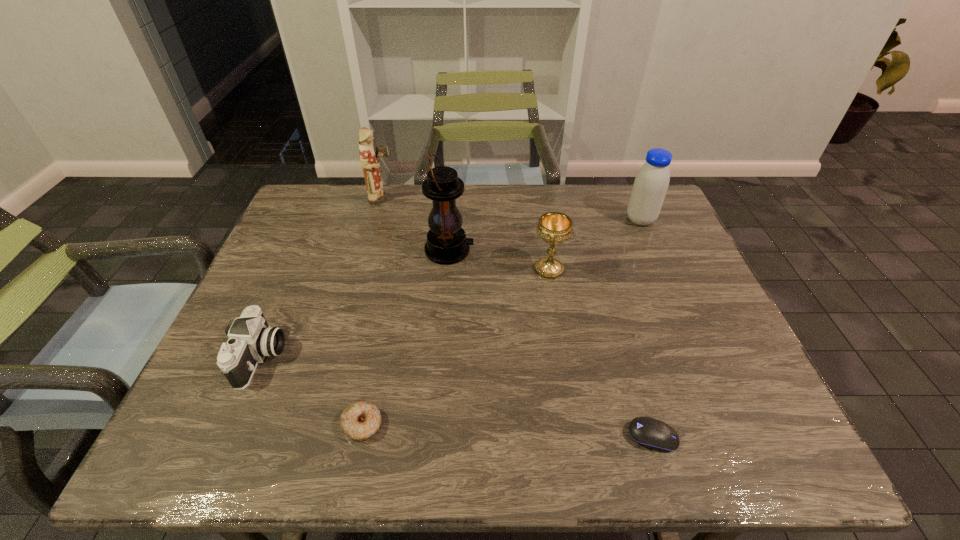
Identify the location of the tallest object. The height and width of the screenshot is (540, 960). (446, 243).

Find the location of a particular element. Image resolution: width=960 pixels, height=540 pixels. lantern is located at coordinates (446, 243).

Find the location of `the sixth object from right to left`. the sixth object from right to left is located at coordinates (368, 158).

This screenshot has width=960, height=540. In order to click on the farthest object in this screenshot , I will do `click(368, 158)`.

Where is `soya milk`? The width and height of the screenshot is (960, 540). soya milk is located at coordinates (651, 183).

Locate an element on the screen. the rightmost object is located at coordinates (651, 183).

Where is `the third object from right to left`? the third object from right to left is located at coordinates (554, 228).

The image size is (960, 540). Identify the location of the fourth shortest object. (554, 228).

The image size is (960, 540). Identify the location of the leftmost object. (250, 338).

Locate an element on the screen. The width and height of the screenshot is (960, 540). the fifth tallest object is located at coordinates (250, 338).